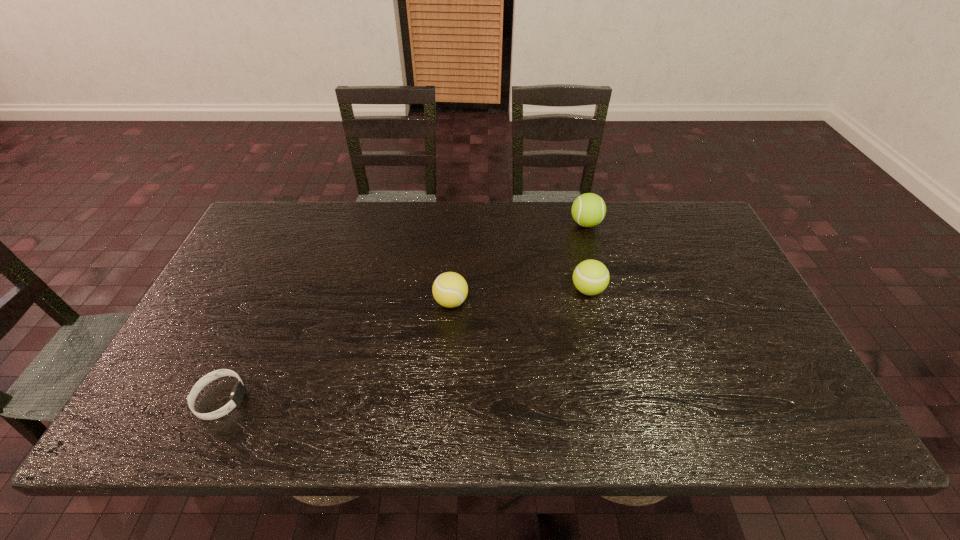
I want to click on vacant area between the farthest tennis ball and the leftmost object, so click(x=403, y=311).

At what (x,y) coordinates should I click in order to perform the action: click on unoccupied position between the farthest tennis ball and the third object from right to left. Please return your answer as a coordinate pair (x, y). The image size is (960, 540). Looking at the image, I should click on pyautogui.click(x=518, y=262).

You are a GUI agent. You are given a task and a screenshot of the screen. Output one action in this format:
    pyautogui.click(x=<x>, y=<y>)
    Task: Click on the free space between the second object from left to right and the shortest object
    This screenshot has width=960, height=540.
    Given the screenshot: What is the action you would take?
    pyautogui.click(x=336, y=350)

The width and height of the screenshot is (960, 540). In order to click on unoccupied area between the farthest tennis ball and the second object from left to right in this screenshot , I will do `click(518, 262)`.

The height and width of the screenshot is (540, 960). I want to click on object that is the second closest to the farthest tennis ball, so click(450, 289).

At what (x,y) coordinates should I click in order to perform the action: click on object that ranks as the third closest to the farthest tennis ball. Please return your answer as a coordinate pair (x, y). Looking at the image, I should click on (236, 397).

Identify which tennis ball is the second nearest to the leftmost object. Please provide its 2D coordinates. Your answer should be formatted as a tuple, i.e. [(x, y)], where the tuple contains the x and y coordinates of a point satisfying the conditions above.

[(591, 277)]

Locate an element on the screen. tennis ball object that ranks as the third closest to the nearest object is located at coordinates (588, 210).

Where is `vacant space that satisfies the following two spatial constraints: 1. on the back side of the second object from left to right; 2. on the right side of the farthest object`? The image size is (960, 540). vacant space that satisfies the following two spatial constraints: 1. on the back side of the second object from left to right; 2. on the right side of the farthest object is located at coordinates (456, 224).